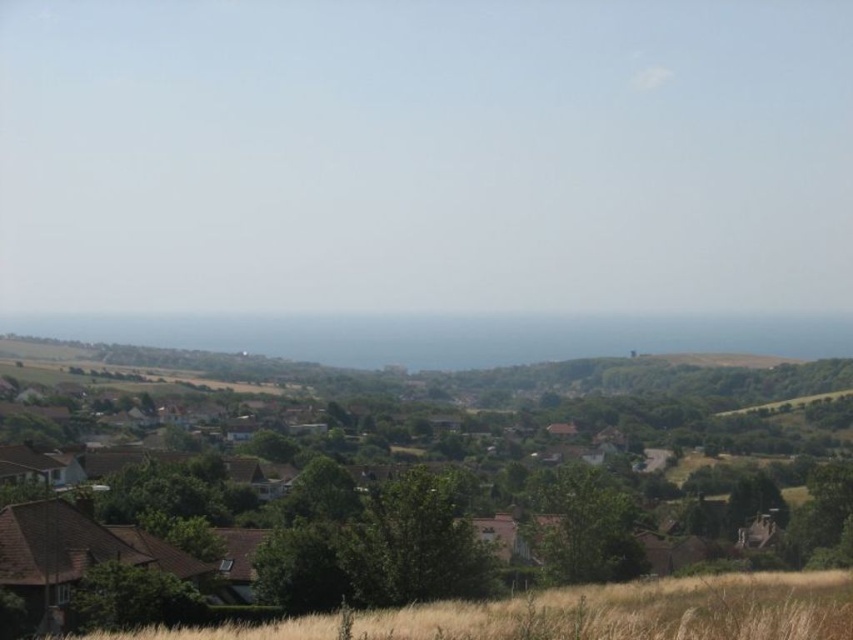
You are standing at the point marked by point (x=390, y=538) in the image. Looking around, you see brown wooden houses at center. Which direction should you walk to reach the dense cluster of houses with red roofs mentioned in the scene description?

The dense cluster of houses with red roofs are located in the background beyond the field of dry grass. Since you are at point (x=390, y=538) which marks the brown wooden houses at center, you should walk forward towards the background to reach the dense cluster of houses with red roofs.

You are a photographer planning to capture a wide landscape shot that includes both the brown wooden houses at center and the blue ocean at center. Based on their sizes in the image, which object would require you to focus on a closer range to ensure it appears sharp and detailed in the photo?

The brown wooden houses at center has a smaller width compared to the blue ocean at center, so you should focus closer to the brown wooden houses at center to ensure it appears sharp and detailed.

You are a photographer standing at the top of a hill overlooking a rural landscape. You notice the brown wooden houses at center and the dry grass at lower center. Which object appears taller from your vantage point?

The brown wooden houses at center appears taller than the dry grass at lower center from your vantage point.